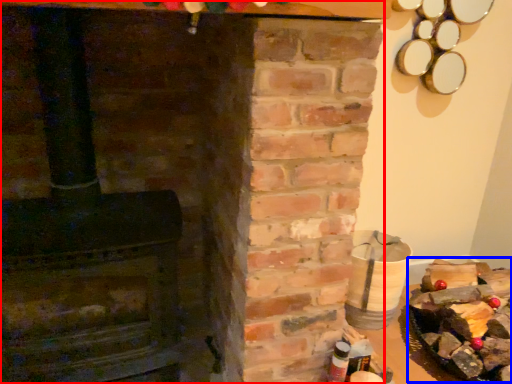
Question: Which point is closer to the camera, fireplace (highlighted by a red box) or food (highlighted by a blue box)?

Choices:
 (A) fireplace
 (B) food

Answer: (A)